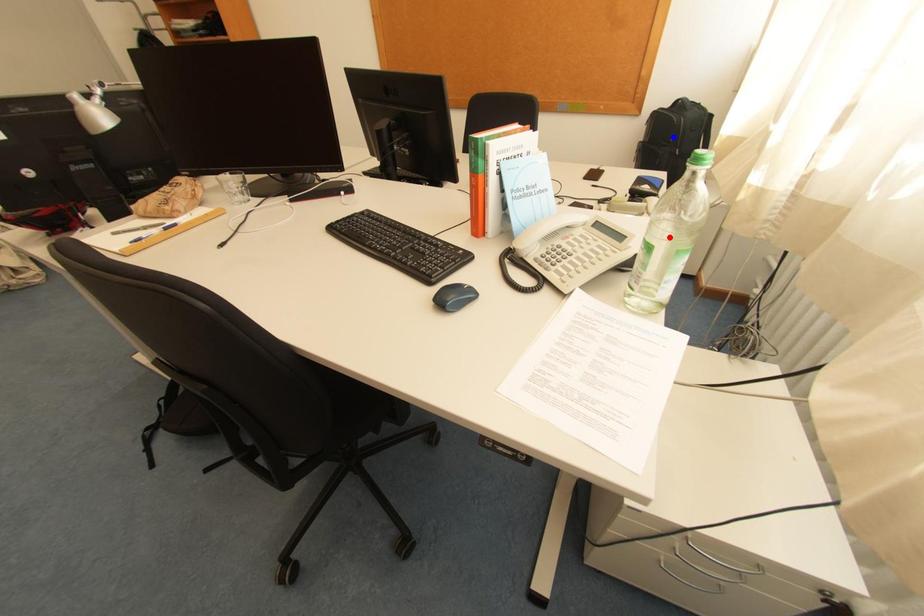
Question: Which of the two points in the image is closer to the camera?

Choices:
 (A) Blue point is closer.
 (B) Red point is closer.

Answer: (B)